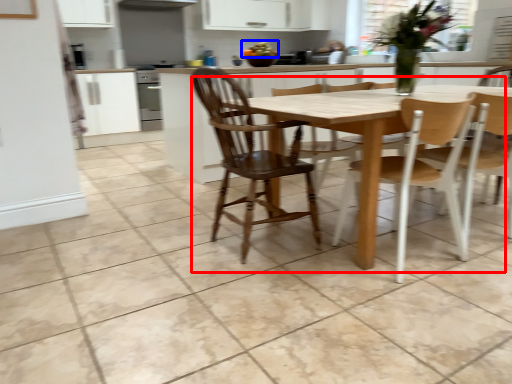
Question: Which object appears farthest to the camera in this image, kitchen & dining room table (highlighted by a red box) or food (highlighted by a blue box)?

Choices:
 (A) kitchen & dining room table
 (B) food

Answer: (B)